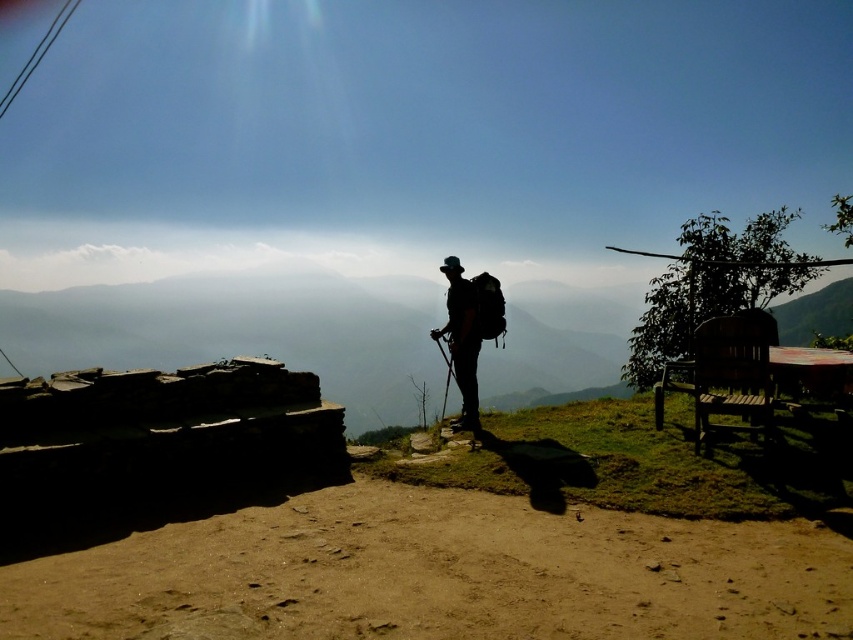
You are standing at the center of the dirt path and see the silhouette backpack at center. If you walk straight ahead, will the backpack remain in your line of sight?

The silhouette backpack at center is located at point (x=462, y=339), so walking straight ahead along the dirt path may keep it in your line of sight depending on the path curvature and surrounding structures.